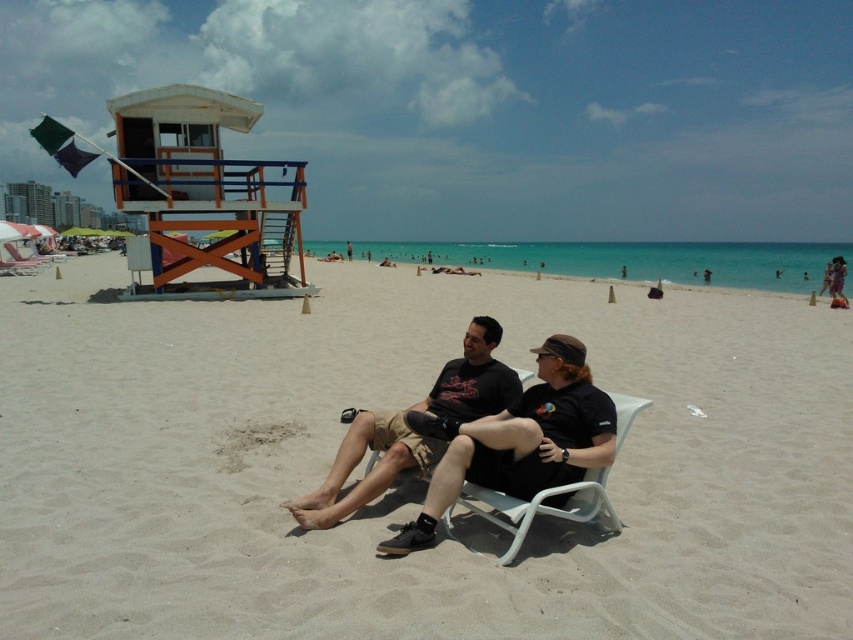
Question: Does light beige sand at center appear over black fabric shirt at center?

Choices:
 (A) yes
 (B) no

Answer: (A)

Question: Does light beige sand at center have a lesser width compared to matte black shirt at center?

Choices:
 (A) yes
 (B) no

Answer: (B)

Question: Which object appears farthest from the camera in this image?

Choices:
 (A) white plastic beach chair at center
 (B) matte black shirt at center
 (C) light beige sand at center
 (D) black fabric shirt at center

Answer: (B)

Question: Which point is farther to the camera?

Choices:
 (A) light beige sand at center
 (B) matte black sunglasses at upper right
 (C) matte black shirt at center

Answer: (B)

Question: Is matte black shirt at center smaller than white plastic beach chair at center?

Choices:
 (A) yes
 (B) no

Answer: (B)

Question: Which point is farther from the camera taking this photo?

Choices:
 (A) (346, 445)
 (B) (680, 358)

Answer: (B)